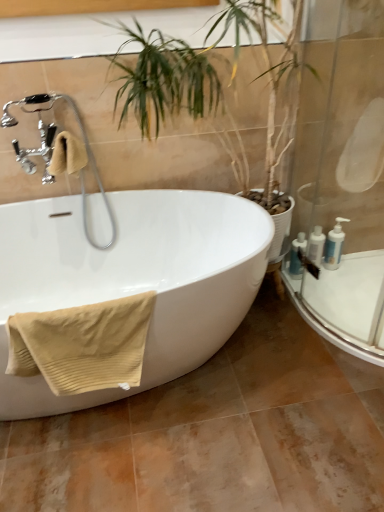
Question: Should I look upward or downward to see beige ribbed towel at left, the 2th bath towel from the front?

Choices:
 (A) down
 (B) up

Answer: (B)

Question: Does white glossy bottle at right, which is the 2th toiletry in right-to-left order, have a smaller size compared to white glossy pump bottles at right, positioned as the first toiletry in right-to-left order?

Choices:
 (A) no
 (B) yes

Answer: (B)

Question: Does white glossy bottle at right, which is the 2th toiletry in right-to-left order, appear on the left side of white glossy pump bottles at right, the third toiletry in the left-to-right sequence?

Choices:
 (A) yes
 (B) no

Answer: (A)

Question: Can you confirm if white glossy bottle at right, which is the 2th toiletry in right-to-left order, is bigger than white glossy pump bottles at right, positioned as the first toiletry in right-to-left order?

Choices:
 (A) no
 (B) yes

Answer: (A)

Question: Is white glossy bottle at right, which is the 2th toiletry in right-to-left order, at the right side of white glossy pump bottles at right, positioned as the first toiletry in right-to-left order?

Choices:
 (A) no
 (B) yes

Answer: (A)

Question: Is white glossy bottle at right, the second toiletry from the left, aimed at white glossy pump bottles at right, the third toiletry in the left-to-right sequence?

Choices:
 (A) no
 (B) yes

Answer: (A)

Question: Is white glossy bottle at right, the second toiletry from the left, placed right next to white glossy pump bottles at right, the third toiletry in the left-to-right sequence?

Choices:
 (A) no
 (B) yes

Answer: (B)

Question: Is transparent glass shower door at right closer to the viewer compared to beige ribbed towel at lower left, which ranks as the 2th bath towel in top-to-bottom order?

Choices:
 (A) yes
 (B) no

Answer: (A)

Question: Does transparent glass shower door at right have a smaller size compared to beige ribbed towel at lower left, which is the first bath towel from bottom to top?

Choices:
 (A) yes
 (B) no

Answer: (B)

Question: Considering the relative sizes of transparent glass shower door at right and beige ribbed towel at lower left, which ranks as the 2th bath towel in top-to-bottom order, in the image provided, is transparent glass shower door at right taller than beige ribbed towel at lower left, which ranks as the 2th bath towel in top-to-bottom order,?

Choices:
 (A) no
 (B) yes

Answer: (B)

Question: Does transparent glass shower door at right appear on the left side of beige ribbed towel at lower left, the second bath towel in the back-to-front sequence?

Choices:
 (A) no
 (B) yes

Answer: (A)

Question: From a real-world perspective, is transparent glass shower door at right physically below beige ribbed towel at lower left, the first bath towel from the front?

Choices:
 (A) no
 (B) yes

Answer: (A)

Question: From the image's perspective, does transparent glass shower door at right appear lower than beige ribbed towel at lower left, which ranks as the 2th bath towel in top-to-bottom order?

Choices:
 (A) yes
 (B) no

Answer: (B)

Question: Would you say beige ribbed towel at left, the second bath towel when ordered from bottom to top, contains white glossy bottles at right, placed as the first toiletry when sorted from left to right?

Choices:
 (A) no
 (B) yes

Answer: (A)